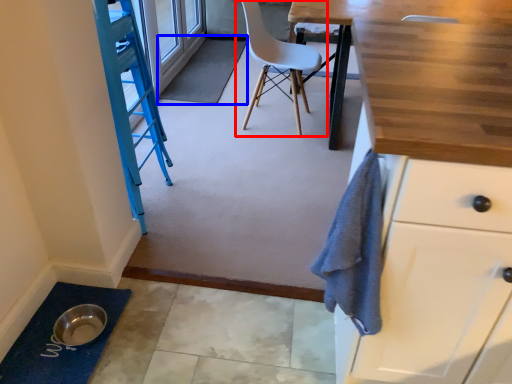
Question: Which of the following is the closest to the observer, chair (highlighted by a red box) or bath mat (highlighted by a blue box)?

Choices:
 (A) chair
 (B) bath mat

Answer: (A)